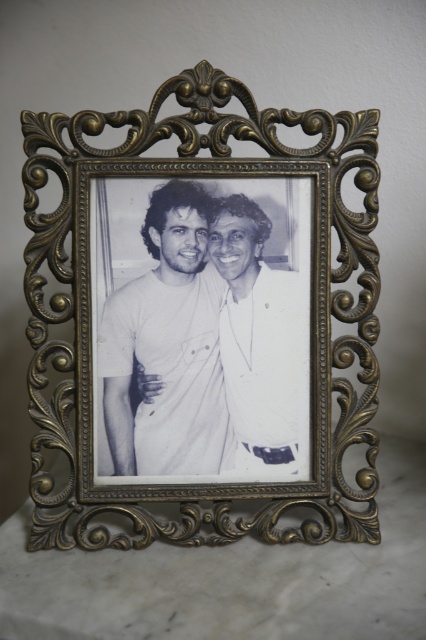
Question: Which point is closer to the camera?

Choices:
 (A) white matte shirt at center
 (B) white paper photo at center
 (C) gold ornate frame at center

Answer: (C)

Question: From the image, what is the correct spatial relationship of white paper photo at center in relation to gold ornate frame at center?

Choices:
 (A) left
 (B) right

Answer: (B)

Question: Which point appears closest to the camera in this image?

Choices:
 (A) (256, 477)
 (B) (353, 157)
 (C) (287, 419)

Answer: (B)

Question: Which of the following is the farthest from the observer?

Choices:
 (A) gold ornate frame at center
 (B) white paper photo at center

Answer: (B)

Question: Is white paper photo at center behind gold ornate frame at center?

Choices:
 (A) yes
 (B) no

Answer: (A)

Question: Is gold ornate frame at center further to camera compared to white matte shirt at center?

Choices:
 (A) yes
 (B) no

Answer: (B)